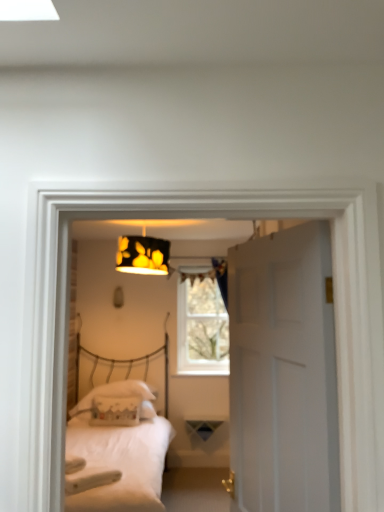
You are a GUI agent. You are given a task and a screenshot of the screen. Output one action in this format:
    pyautogui.click(x=<x>, y=<y>)
    Task: Click on the blank space situated above white fabric pillow at center, the first pillow from the front (from a real-world perspective)
    This screenshot has height=512, width=384.
    Given the screenshot: What is the action you would take?
    pyautogui.click(x=119, y=391)